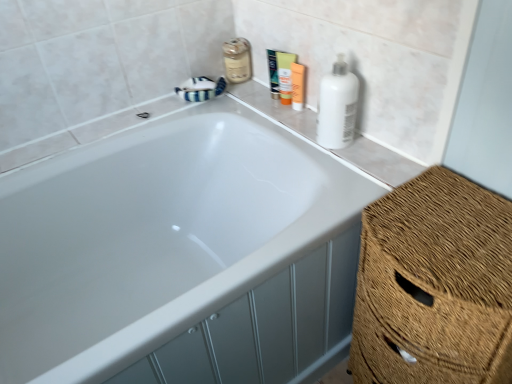
Where is `free space in front of matte orange tube at upper center, positioned as the second toiletry in right-to-left order`? The image size is (512, 384). free space in front of matte orange tube at upper center, positioned as the second toiletry in right-to-left order is located at coordinates (294, 115).